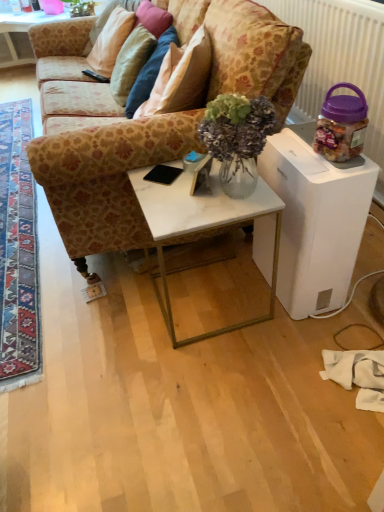
Describe the element at coordinates (111, 41) in the screenshot. The height and width of the screenshot is (512, 384). I see `beige fabric pillow at upper left, the second pillow from the right` at that location.

Image resolution: width=384 pixels, height=512 pixels. What are the coordinates of `beige fabric pillow at upper left, which is the first pillow from left to right` in the screenshot? It's located at (111, 41).

Identify the location of patterned fabric couch at center. The width and height of the screenshot is (384, 512). (156, 124).

Is black matte mobile phone at center not near velvet beige pillow at upper center, the 1th pillow in the right-to-left sequence?

Yes, black matte mobile phone at center and velvet beige pillow at upper center, the 1th pillow in the right-to-left sequence, are quite far apart.

In the scene shown: Is velvet beige pillow at upper center, the 1th pillow in the right-to-left sequence, located within black matte mobile phone at center?

No, velvet beige pillow at upper center, the 1th pillow in the right-to-left sequence, is not surrounded by black matte mobile phone at center.

From the image's perspective, starting from the black matte mobile phone at center, which pillow is the 1st one above? Please provide its 2D coordinates.

[(131, 62)]

Who is more distant, black matte mobile phone at center or velvet beige pillow at upper center, which ranks as the second pillow in left-to-right order?

velvet beige pillow at upper center, which ranks as the second pillow in left-to-right order, is more distant.

How many degrees apart are the facing directions of carpeted rug at lower left and white glossy humidifier at right, which is the 3th table from back to front?

There is a 180-degree angle between the facing directions of carpeted rug at lower left and white glossy humidifier at right, which is the 3th table from back to front.

You are a GUI agent. You are given a task and a screenshot of the screen. Output one action in this format:
    pyautogui.click(x=<x>, y=<y>)
    Task: Click on the mat behind the white glossy humidifier at right, which is the 3th table from back to front
    The width and height of the screenshot is (384, 512).
    Given the screenshot: What is the action you would take?
    coord(18,253)

From the image's perspective, is carpeted rug at lower left above white glossy humidifier at right, the first table viewed from the front?

Yes.

Does carpeted rug at lower left appear on the left side of white glossy humidifier at right, arranged as the third table when viewed from the left?

Answer: Correct, you'll find carpeted rug at lower left to the left of white glossy humidifier at right, arranged as the third table when viewed from the left.

From a real-world perspective, is white marble table at center, which is the 2th table from left to right, physically above translucent glass vase at center?

Incorrect, from a real-world perspective, white marble table at center, which is the 2th table from left to right, is lower than translucent glass vase at center.

From the image's perspective, which is below, white marble table at center, arranged as the second table when viewed from the front, or translucent glass vase at center?

white marble table at center, arranged as the second table when viewed from the front, appears lower in the image.

The width and height of the screenshot is (384, 512). What are the coordinates of `the 1st table to the left of the translucent glass vase at center, starting your count from the anchor` in the screenshot? It's located at (200, 227).

Is white marble table at center, which ranks as the 2th table in right-to-left order, touching translucent glass vase at center?

No, white marble table at center, which ranks as the 2th table in right-to-left order, is not in contact with translucent glass vase at center.

From the picture: Is black plastic remote control at upper left beside translucent glass vase at center?

No, black plastic remote control at upper left is not with translucent glass vase at center.

Looking at their sizes, would you say black plastic remote control at upper left is wider or thinner than translucent glass vase at center?

Considering their sizes, black plastic remote control at upper left looks slimmer than translucent glass vase at center.

Does black plastic remote control at upper left have a larger size compared to translucent glass vase at center?

No.

How distant is white marble table at center, marked as the 2th table in a back-to-front arrangement, from carpeted rug at lower left?

They are 36.38 inches apart.

Which object is further away from the camera, white marble table at center, arranged as the second table when viewed from the front, or carpeted rug at lower left?

Positioned behind is carpeted rug at lower left.

Considering the points (221, 191) and (6, 129), which point is behind, point (221, 191) or point (6, 129)?

Point (6, 129)

Are white marble table at center, positioned as the third table in top-to-bottom order, and carpeted rug at lower left located far from each other?

No, there isn't a large distance between white marble table at center, positioned as the third table in top-to-bottom order, and carpeted rug at lower left.

Who is shorter, patterned fabric couch at center or beige fabric pillow at upper left, which is the first pillow from left to right?

With less height is beige fabric pillow at upper left, which is the first pillow from left to right.

Is patterned fabric couch at center behind beige fabric pillow at upper left, the second pillow from the right?

No.

Is patterned fabric couch at center spatially inside beige fabric pillow at upper left, which is the first pillow from left to right, or outside of it?

patterned fabric couch at center is spatially situated outside beige fabric pillow at upper left, which is the first pillow from left to right.

How much distance is there between velvet beige pillow at upper center, which ranks as the second pillow in left-to-right order, and white glossy humidifier at right, which ranks as the second table in top-to-bottom order?

velvet beige pillow at upper center, which ranks as the second pillow in left-to-right order, is 3.93 feet away from white glossy humidifier at right, which ranks as the second table in top-to-bottom order.

Is velvet beige pillow at upper center, which ranks as the second pillow in left-to-right order, oriented away from white glossy humidifier at right, arranged as the third table when viewed from the left?

No.

Considering the relative sizes of velvet beige pillow at upper center, the 1th pillow in the right-to-left sequence, and white glossy humidifier at right, which ranks as the second table in top-to-bottom order, in the image provided, is velvet beige pillow at upper center, the 1th pillow in the right-to-left sequence, bigger than white glossy humidifier at right, which ranks as the second table in top-to-bottom order,?

Actually, velvet beige pillow at upper center, the 1th pillow in the right-to-left sequence, might be smaller than white glossy humidifier at right, which ranks as the second table in top-to-bottom order.

Is velvet beige pillow at upper center, which ranks as the second pillow in left-to-right order, far from white glossy humidifier at right, which ranks as the 1th table in right-to-left order?

That's right, there is a large distance between velvet beige pillow at upper center, which ranks as the second pillow in left-to-right order, and white glossy humidifier at right, which ranks as the 1th table in right-to-left order.

This screenshot has width=384, height=512. In order to click on pillow that is the 1st object located above the black matte mobile phone at center (from the image's perspective) in this screenshot , I will do `click(131, 62)`.

I want to click on the 2nd table in front of the carpeted rug at lower left, counting from the anchor's position, so click(316, 219).

Considering their positions, is patterned fabric couch at center positioned further to black plastic remote control at upper left than black matte mobile phone at center?

black matte mobile phone at center lies further to black plastic remote control at upper left than the other object.

Which object lies further to the anchor point white glossy humidifier at right, arranged as the third table when viewed from the left, velvet beige pillow at upper center, which ranks as the second pillow in left-to-right order, or white marble table at center, the 3th table viewed from the right?

white marble table at center, the 3th table viewed from the right.

Considering their positions, is white marble table at center, which is the 2th table from left to right, positioned further to patterned fabric couch at center than velvet beige pillow at upper center, the 1th pillow in the right-to-left sequence?

velvet beige pillow at upper center, the 1th pillow in the right-to-left sequence, lies further to patterned fabric couch at center than the other object.

From the image, which object appears to be farther from patterned fabric couch at center, carpeted rug at lower left or white marble table at center, the first table from the left?

white marble table at center, the first table from the left, is positioned further to the anchor patterned fabric couch at center.

Considering their positions, is translucent glass vase at center positioned closer to black plastic remote control at upper left than patterned fabric couch at center?

patterned fabric couch at center is closer to black plastic remote control at upper left.

Based on their spatial positions, is black plastic remote control at upper left or white marble table at center, which is counted as the first table, starting from the bottom, closer to beige fabric pillow at upper left, which is the first pillow from left to right?

black plastic remote control at upper left is positioned closer to the anchor beige fabric pillow at upper left, which is the first pillow from left to right.

Considering their positions, is black plastic remote control at upper left positioned closer to white marble table at center, arranged as the second table when viewed from the front, than velvet beige pillow at upper center, which ranks as the second pillow in left-to-right order?

velvet beige pillow at upper center, which ranks as the second pillow in left-to-right order, is positioned closer to the anchor white marble table at center, arranged as the second table when viewed from the front.

When comparing their distances from patterned fabric couch at center, does white marble table at center, which appears as the first table when viewed from the top, or translucent glass vase at center seem closer?

translucent glass vase at center lies closer to patterned fabric couch at center than the other object.

Image resolution: width=384 pixels, height=512 pixels. I want to click on mat positioned between black matte mobile phone at center and black plastic remote control at upper left from near to far, so click(x=18, y=253).

Where is `remote control positioned between velvet beige pillow at upper center, the 1th pillow in the right-to-left sequence, and white marble table at center, which appears as the first table when viewed from the top, from near to far`? The image size is (384, 512). remote control positioned between velvet beige pillow at upper center, the 1th pillow in the right-to-left sequence, and white marble table at center, which appears as the first table when viewed from the top, from near to far is located at coordinates (95, 76).

The image size is (384, 512). I want to click on mat between white marble table at center, which is the 2th table from left to right, and white marble table at center, the 3th table viewed from the right, from front to back, so click(x=18, y=253).

Where is `houseplant between velvet beige pillow at upper center, which ranks as the second pillow in left-to-right order, and white marble table at center, arranged as the second table when viewed from the front, in the up-down direction`? This screenshot has width=384, height=512. houseplant between velvet beige pillow at upper center, which ranks as the second pillow in left-to-right order, and white marble table at center, arranged as the second table when viewed from the front, in the up-down direction is located at coordinates (237, 139).